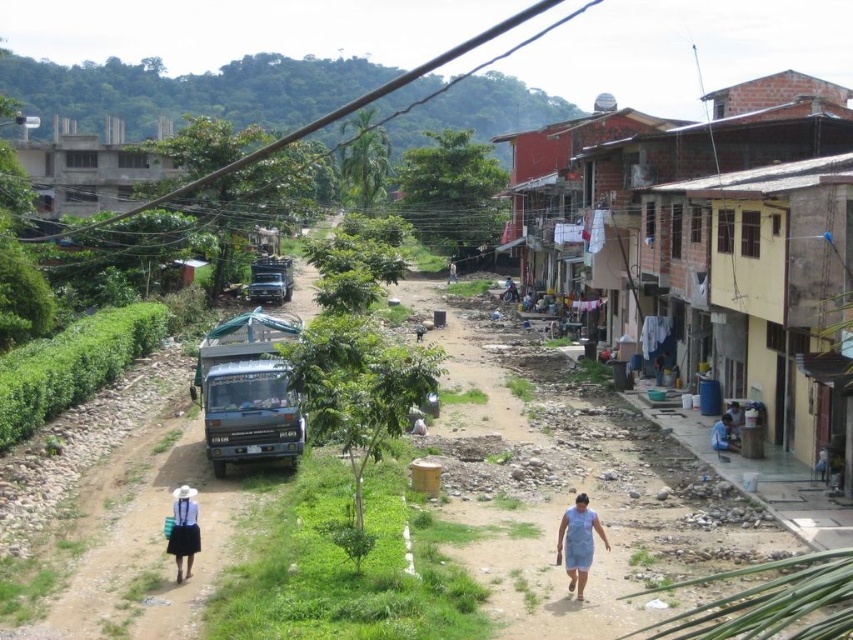
You are a delivery person who needs to park your vehicle between the brick building at right and the blue matte truck at center. Is there enough space between them for your car?

The brick building at right is located above the blue matte truck at center, meaning they are not aligned horizontally. Therefore, there is sufficient space between them for your car to park.

You are a delivery person standing at the blue matte truck at center and need to deliver a package to the blue fabric shirt at lower right. The delivery robot you are using has a maximum range of 10 meters. Can you complete the delivery without needing to recharge?

The blue matte truck at center is 10.47 meters from the blue fabric shirt at lower right. Since the distance is slightly over the robot maximum range of 10 meters, you cannot complete the delivery without recharging.